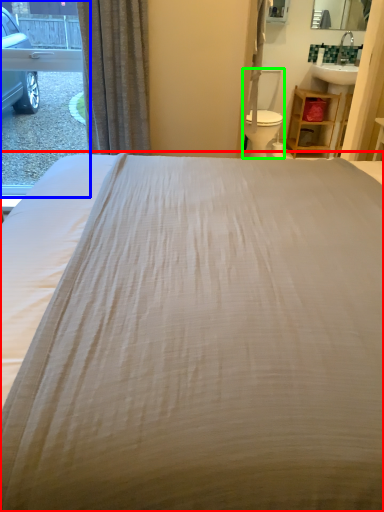
Question: Which is nearer to the bed (highlighted by a red box)? window (highlighted by a blue box) or swivel chair (highlighted by a green box).

Choices:
 (A) window
 (B) swivel chair

Answer: (B)